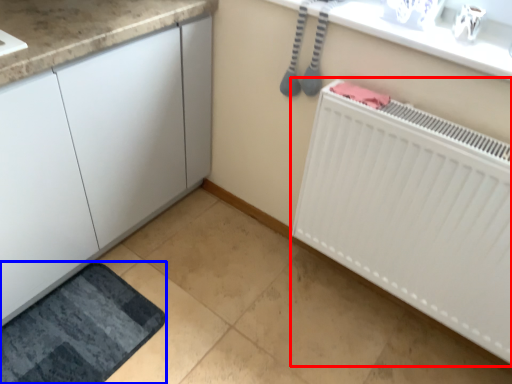
Question: Which point is further to the camera, radiator (highlighted by a red box) or bath mat (highlighted by a blue box)?

Choices:
 (A) radiator
 (B) bath mat

Answer: (B)